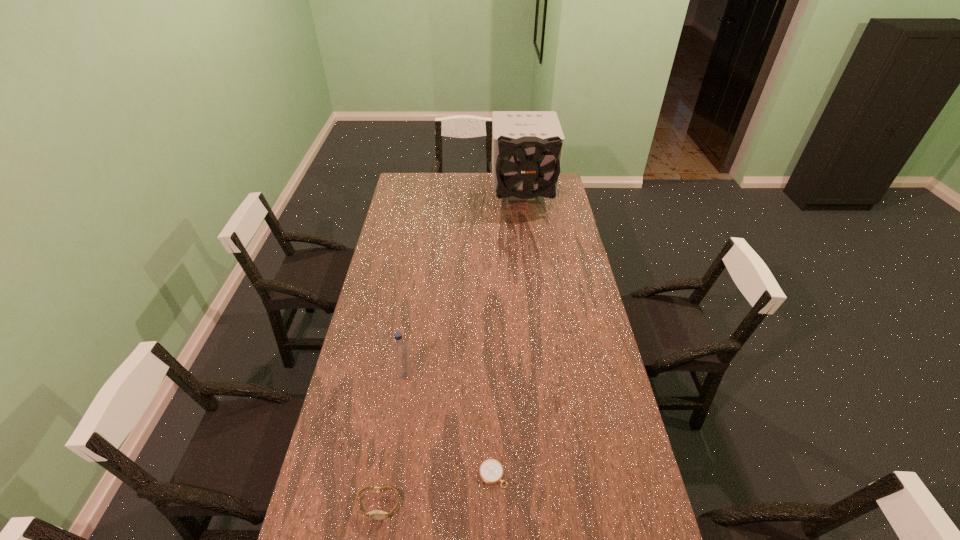
Where is `vacant area that lies between the second farthest object and the nearest object`? vacant area that lies between the second farthest object and the nearest object is located at coordinates (392, 440).

I want to click on free space between the nearest object and the second tallest object, so click(x=392, y=440).

The height and width of the screenshot is (540, 960). I want to click on free space between the third tallest object and the second tallest object, so click(392, 440).

Locate an element on the screen. The image size is (960, 540). empty location between the second tallest object and the shortest object is located at coordinates (449, 425).

You are a GUI agent. You are given a task and a screenshot of the screen. Output one action in this format:
    pyautogui.click(x=<x>, y=<y>)
    Task: Click on the blank region between the third farthest object and the watch
    The height and width of the screenshot is (540, 960).
    Given the screenshot: What is the action you would take?
    coord(436,490)

Identify the location of free space between the watch and the shortest object. The width and height of the screenshot is (960, 540). (436, 490).

What are the coordinates of `free point between the tallest object and the third shortest object` in the screenshot? It's located at (464, 286).

Locate an element on the screen. The width and height of the screenshot is (960, 540). free point between the compass and the third nearest object is located at coordinates (449, 425).

Locate an element on the screen. empty location between the watch and the fan is located at coordinates (450, 351).

Find the location of a particular element. The width and height of the screenshot is (960, 540). the third closest object relative to the third farthest object is located at coordinates (527, 146).